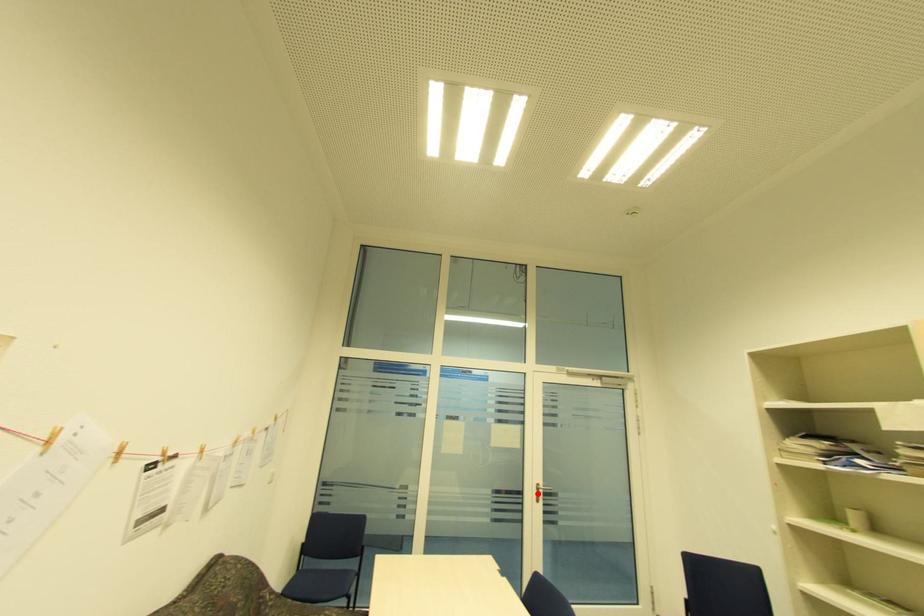
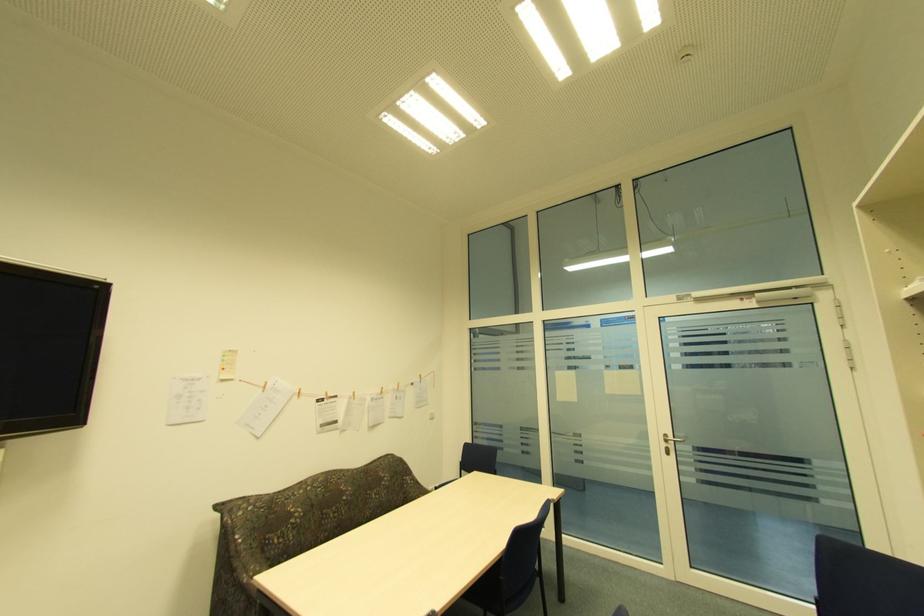
In the second image, find the point that corresponds to the highlighted location in the first image.

(666, 445)